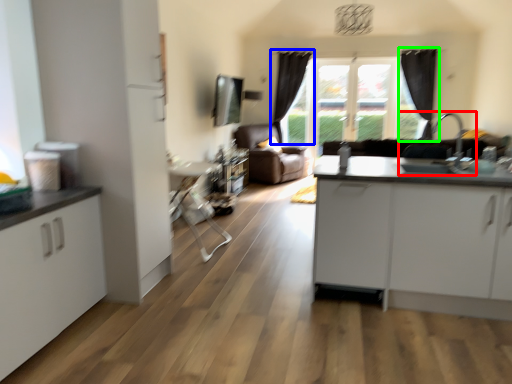
Question: Which object is the closest to the sink (highlighted by a red box)? Choose among these: curtain (highlighted by a blue box) or curtain (highlighted by a green box).

Choices:
 (A) curtain
 (B) curtain

Answer: (B)